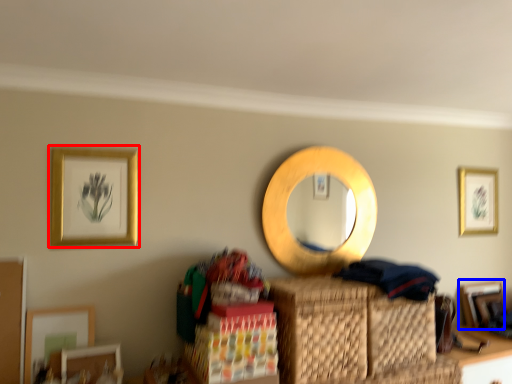
Question: Which object appears closest to the camera in this image, picture frame (highlighted by a red box) or picture frame (highlighted by a blue box)?

Choices:
 (A) picture frame
 (B) picture frame

Answer: (A)